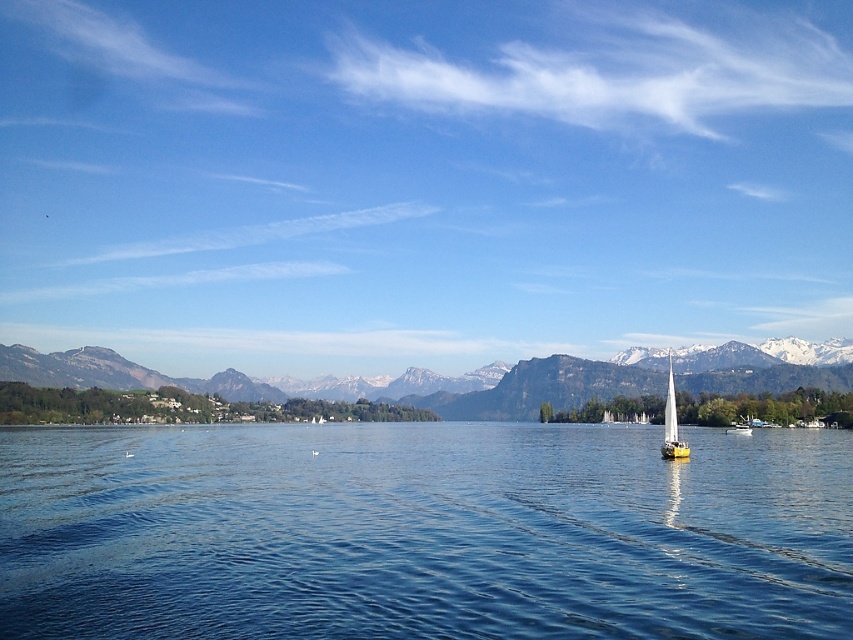
Can you confirm if green grassy mountain at center is shorter than yellow matte sailboat at right?

In fact, green grassy mountain at center may be taller than yellow matte sailboat at right.

Between point (454, 406) and point (670, 352), which one is positioned in front?

Point (454, 406)

Where is `green grassy mountain at center`? This screenshot has width=853, height=640. green grassy mountain at center is located at coordinates (537, 387).

Based on the photo, can you confirm if blue water at center is thinner than yellow sailboat at right?

No.

Measure the distance between blue water at center and yellow sailboat at right.

100.74 meters

What do you see at coordinates (422, 532) in the screenshot? The width and height of the screenshot is (853, 640). I see `blue water at center` at bounding box center [422, 532].

Find the location of `blue water at center`. blue water at center is located at coordinates (422, 532).

Can you confirm if blue sky at upper center is shorter than blue water at center?

Incorrect, blue sky at upper center's height does not fall short of blue water at center's.

Is point (834, 97) closer to viewer compared to point (369, 486)?

That is False.

Find the location of `blue sky at upper center`. blue sky at upper center is located at coordinates (421, 179).